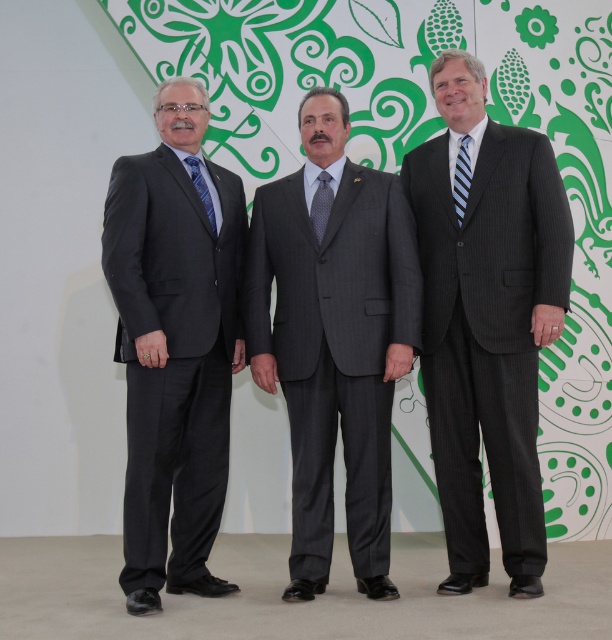
Does pinstriped suit at center appear over gray pinstripe suit at center?

Yes, pinstriped suit at center is above gray pinstripe suit at center.

Which is behind, point (442, 115) or point (302, 193)?

Positioned behind is point (442, 115).

This screenshot has height=640, width=612. Identify the location of pinstriped suit at center. (487, 321).

Is matte black suit at left shorter than blue silk tie at center?

Incorrect, matte black suit at left's height does not fall short of blue silk tie at center's.

Does matte black suit at left have a greater height compared to blue silk tie at center?

Yes.

Based on the photo, who is more distant from viewer, (225, 300) or (215, 225)?

Point (225, 300)

Locate an element on the screen. The image size is (612, 640). matte black suit at left is located at coordinates (174, 346).

Is matte black suit at left above striped fabric tie at center?

Actually, matte black suit at left is below striped fabric tie at center.

The height and width of the screenshot is (640, 612). In order to click on matte black suit at left in this screenshot , I will do `click(174, 346)`.